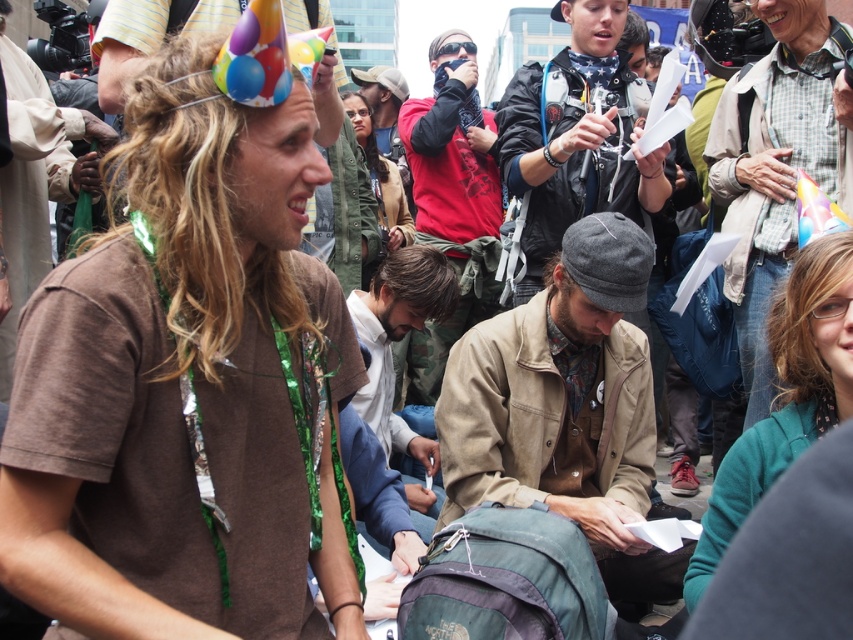
You are organizing a clothing donation drive and need to sort shirts by size. You have a flannel shirt at center and a red cotton shirt at center. Which shirt should you place in the large size bin?

The flannel shirt at center should be placed in the large size bin since its width is larger than the red cotton shirt at center.